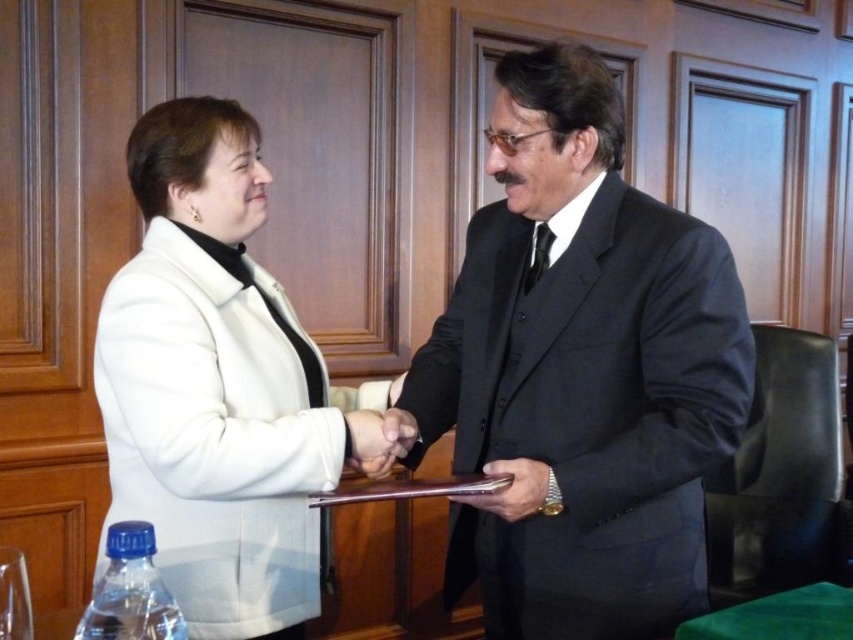
Question: Among these objects, which one is nearest to the camera?

Choices:
 (A) white woolen coat at center
 (B) smooth skin handshake at center
 (C) black satin suit at center
 (D) leather wallet at center

Answer: (A)

Question: Is black satin suit at center to the right of white woolen coat at center from the viewer's perspective?

Choices:
 (A) yes
 (B) no

Answer: (A)

Question: Does black satin suit at center appear on the right side of white woolen coat at center?

Choices:
 (A) yes
 (B) no

Answer: (A)

Question: Which of these objects is positioned closest to the leather wallet at center?

Choices:
 (A) black satin suit at center
 (B) smooth skin handshake at center

Answer: (B)

Question: Which point is farther to the camera?

Choices:
 (A) (489, 493)
 (B) (209, 310)
 (C) (541, 563)

Answer: (C)

Question: Is white woolen coat at center closer to the viewer compared to smooth skin handshake at center?

Choices:
 (A) yes
 (B) no

Answer: (A)